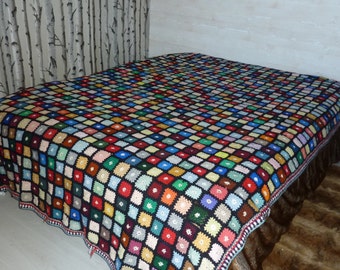
Where is `trim of bedspread`? The height and width of the screenshot is (270, 340). trim of bedspread is located at coordinates click(x=72, y=234).